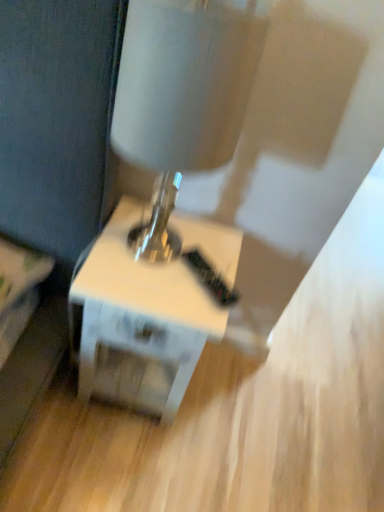
At what (x,y) coordinates should I click in order to perform the action: click on free location to the right of white glossy table at center. Please return your answer as a coordinate pair (x, y). This screenshot has width=384, height=512. Looking at the image, I should click on (230, 411).